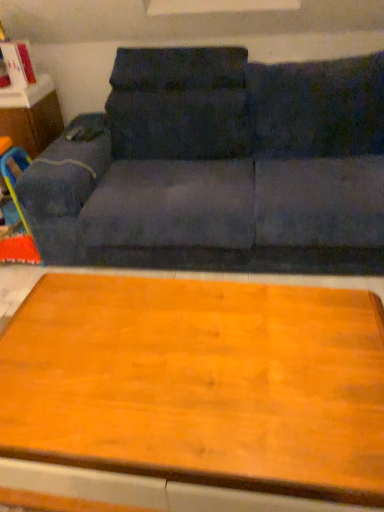
Question: Is point (39, 87) positioned closer to the camera than point (175, 395)?

Choices:
 (A) closer
 (B) farther

Answer: (B)

Question: In terms of height, does matte wood dresser at left look taller or shorter compared to wooden table at lower center?

Choices:
 (A) tall
 (B) short

Answer: (A)

Question: Considering the real-world distances, which object is farthest from the dark blue fabric couch at upper center?

Choices:
 (A) matte wood dresser at left
 (B) wooden table at lower center

Answer: (B)

Question: Which object is the farthest from the dark blue fabric couch at upper center?

Choices:
 (A) wooden table at lower center
 (B) matte wood dresser at left

Answer: (A)